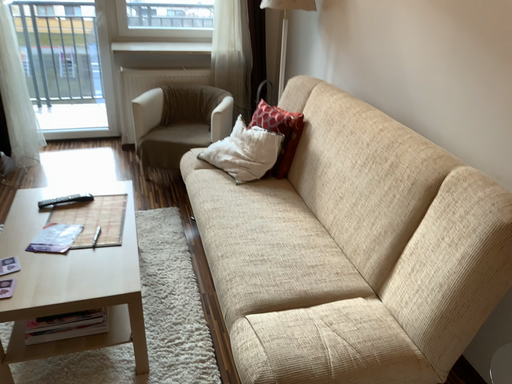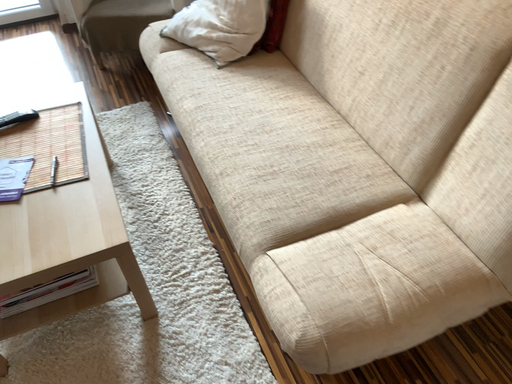
Question: How did the camera likely rotate when shooting the video?

Choices:
 (A) rotated downward
 (B) rotated upward

Answer: (A)